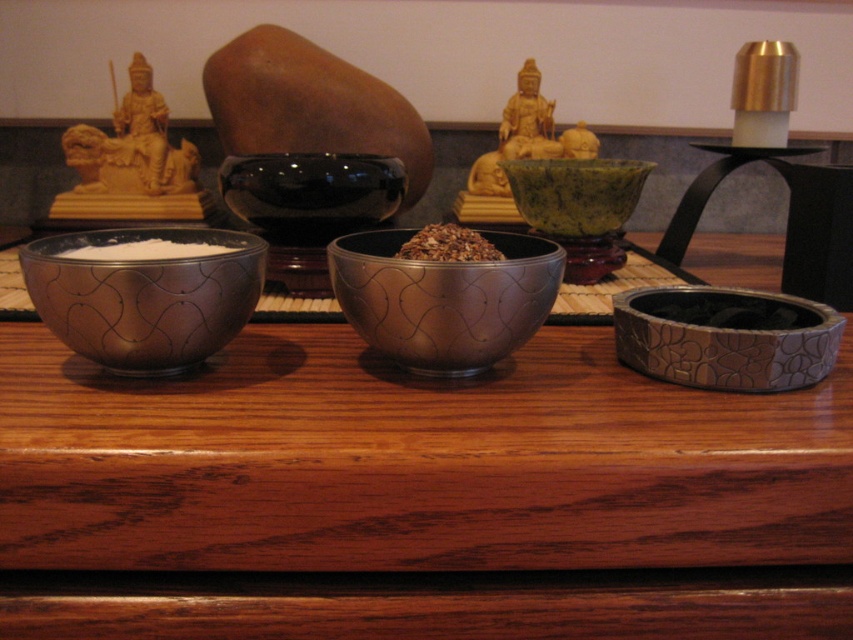
Question: Does brown polished wood table at center have a lesser width compared to metallic silver bowl at center?

Choices:
 (A) no
 (B) yes

Answer: (A)

Question: Which point is closer to the camera?

Choices:
 (A) (366, 241)
 (B) (109, 241)
 (C) (74, 296)
 (D) (663, 340)

Answer: (C)

Question: Does textured brown bowl at right lie behind brown textured rice at center?

Choices:
 (A) yes
 (B) no

Answer: (A)

Question: Among these points, which one is nearest to the camera?

Choices:
 (A) (416, 234)
 (B) (592, 161)
 (C) (184, 352)

Answer: (C)

Question: Among these points, which one is farthest from the camera?

Choices:
 (A) (73, 256)
 (B) (566, 280)
 (C) (403, 248)
 (D) (137, 289)

Answer: (B)

Question: Is metallic silver bowl at center wider than brown textured rice at center?

Choices:
 (A) no
 (B) yes

Answer: (B)